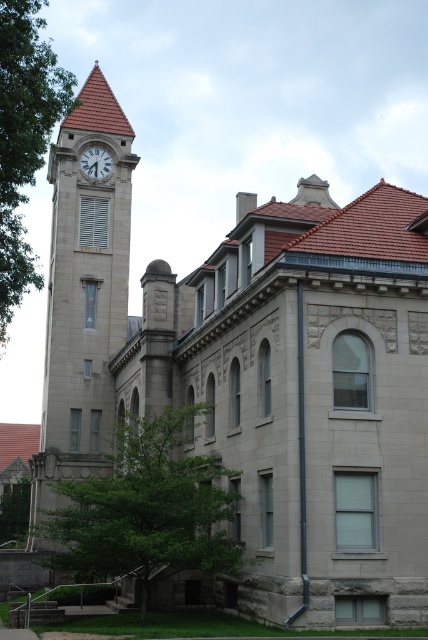
Is green leafy tree at left in front of green leafy tree at lower left?

Yes, green leafy tree at left is closer to the viewer.

Consider the image. Does green leafy tree at left appear on the right side of green leafy tree at lower left?

Indeed, green leafy tree at left is positioned on the right side of green leafy tree at lower left.

Locate an element on the screen. The width and height of the screenshot is (428, 640). green leafy tree at left is located at coordinates (23, 138).

The width and height of the screenshot is (428, 640). I want to click on green leafy tree at left, so click(x=23, y=138).

Does green leafy tree at left have a lesser height compared to white marble clock at upper left?

Incorrect, green leafy tree at left's height does not fall short of white marble clock at upper left's.

Between point (20, 276) and point (82, 166), which one is positioned behind?

The point (82, 166) is behind.

Where is `green leafy tree at left`? green leafy tree at left is located at coordinates (23, 138).

Can you confirm if green leafy tree at lower center is positioned below green leafy tree at left?

Yes.

Who is shorter, green leafy tree at lower center or green leafy tree at left?

Standing shorter between the two is green leafy tree at lower center.

Is point (110, 476) less distant than point (2, 291)?

No.

I want to click on green leafy tree at lower center, so click(148, 508).